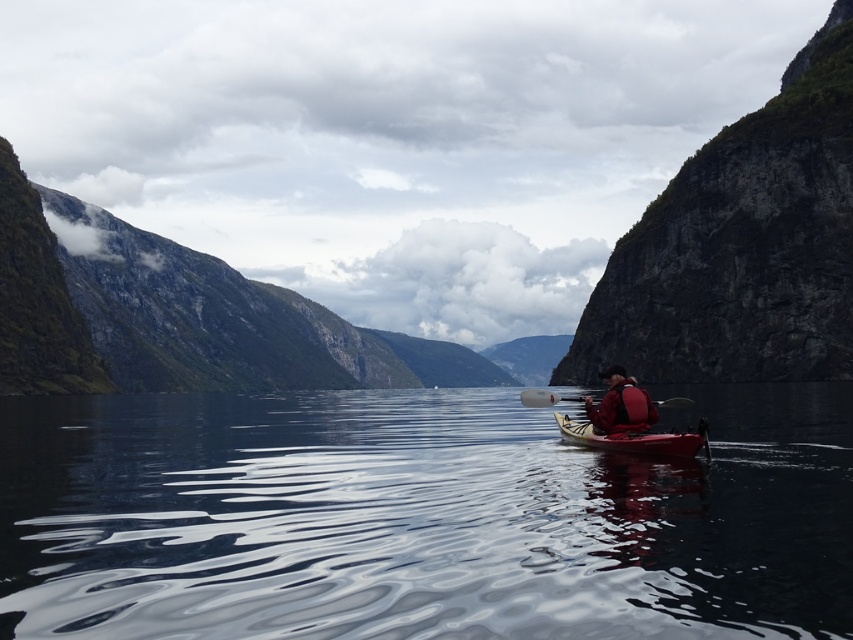
Question: Which point is farther from the camera taking this photo?

Choices:
 (A) (670, 435)
 (B) (788, 93)

Answer: (B)

Question: Which point appears farthest from the camera in this image?

Choices:
 (A) (453, 456)
 (B) (680, 433)
 (C) (527, 404)
 (D) (601, 428)

Answer: (A)

Question: Is matte red canoe at center thinner than white plastic paddle at center?

Choices:
 (A) yes
 (B) no

Answer: (A)

Question: Estimate the real-world distances between objects in this image. Which object is closer to the white plastic paddle at center?

Choices:
 (A) red nylon jacket at center
 (B) glossy water at center

Answer: (A)

Question: Can you confirm if glossy water at center is positioned above rugged stone cliff at right?

Choices:
 (A) no
 (B) yes

Answer: (A)

Question: Is the position of rugged stone cliff at right more distant than that of matte red canoe at center?

Choices:
 (A) no
 (B) yes

Answer: (B)